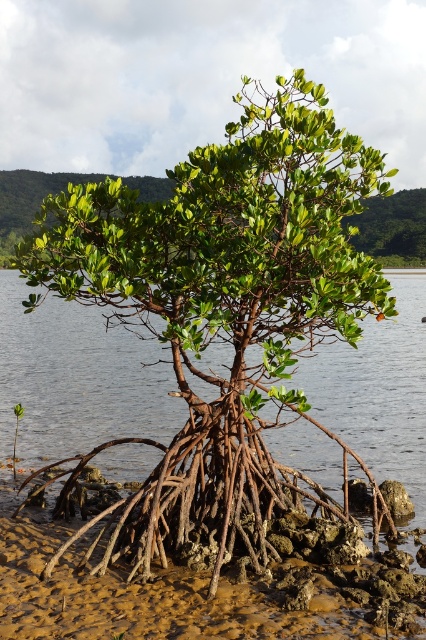
Question: Which of the following is the closest to the observer?

Choices:
 (A) (405, 602)
 (B) (282, 385)

Answer: (A)

Question: Does green matte tree at center appear on the right side of brown mud roots at center?

Choices:
 (A) no
 (B) yes

Answer: (A)

Question: Can you confirm if green matte tree at center is positioned below brown mud roots at center?

Choices:
 (A) no
 (B) yes

Answer: (A)

Question: Does green matte tree at center appear on the left side of brown mud roots at center?

Choices:
 (A) yes
 (B) no

Answer: (A)